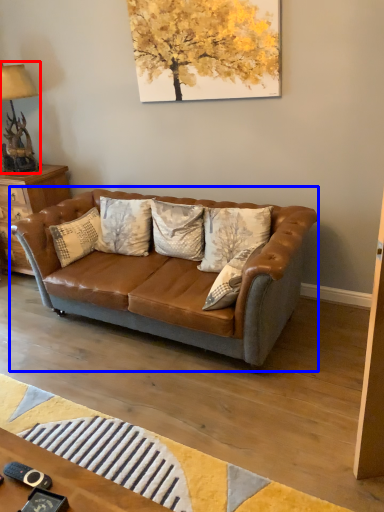
Question: Which point is further to the camera, lamp (highlighted by a red box) or studio couch (highlighted by a blue box)?

Choices:
 (A) lamp
 (B) studio couch

Answer: (A)